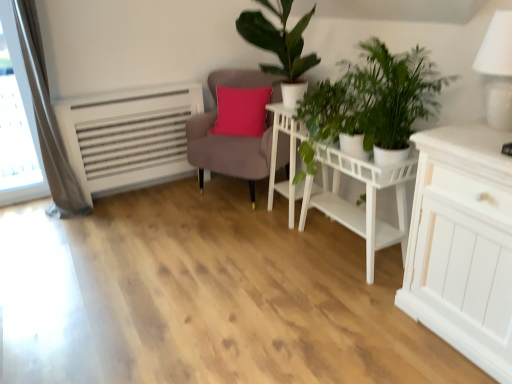
Question: From the image's perspective, is white matte side table at center above or below green matte plant at upper center, which ranks as the 1th houseplant in back-to-front order?

Choices:
 (A) below
 (B) above

Answer: (A)

Question: From a real-world perspective, is white matte side table at center physically located above or below green matte plant at upper center, positioned as the second houseplant in front-to-back order?

Choices:
 (A) above
 (B) below

Answer: (B)

Question: Which is nearer to the green leafy plant at center?

Choices:
 (A) white matte table at center
 (B) green matte plant at upper center, positioned as the second houseplant in front-to-back order
 (C) gray fabric curtain at left
 (D) matte brown armchair at center
 (E) green leafy plant at center right, which is the first houseplant in front-to-back order

Answer: (E)

Question: Estimate the real-world distances between objects in this image. Which object is closer to the white curtain at left?

Choices:
 (A) gray fabric curtain at left
 (B) white matte side table at center
 (C) green leafy plant at center right, which ranks as the second houseplant in back-to-front order
 (D) white matte table at center
 (E) green leafy plant at center

Answer: (A)